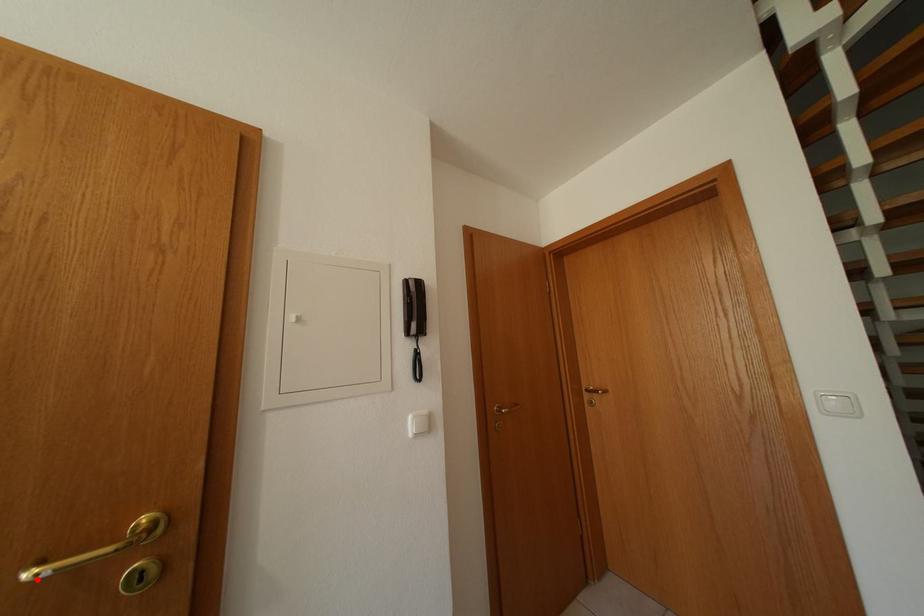
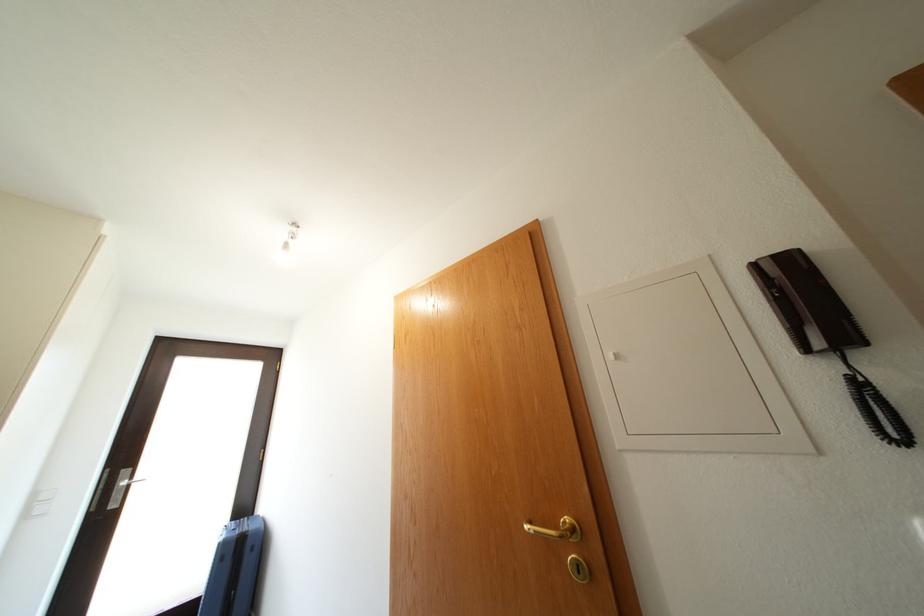
The point at the highlighted location is marked in the first image. Where is the corresponding point in the second image?

(535, 533)